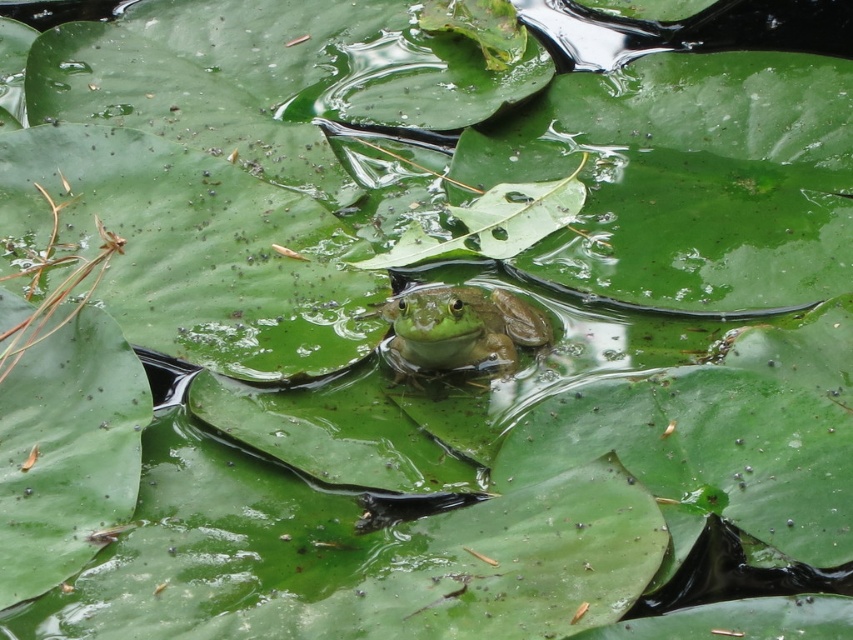
Does green matte tree frog at center appear on the left side of green matte leaf at center?

Yes, green matte tree frog at center is to the left of green matte leaf at center.

Does point (422, 332) come farther from viewer compared to point (482, 200)?

No, (422, 332) is closer to viewer.

Find the location of a particular element. green matte tree frog at center is located at coordinates (461, 330).